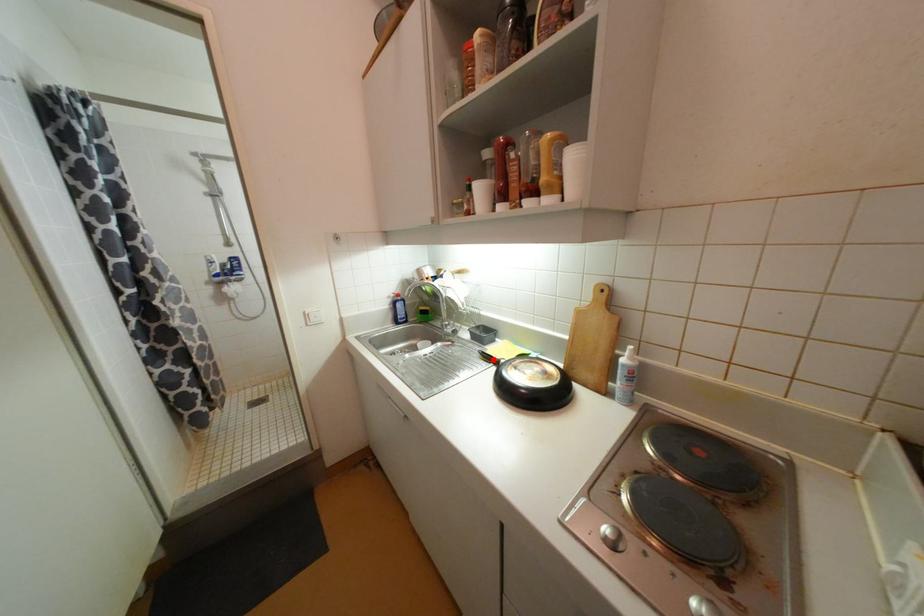
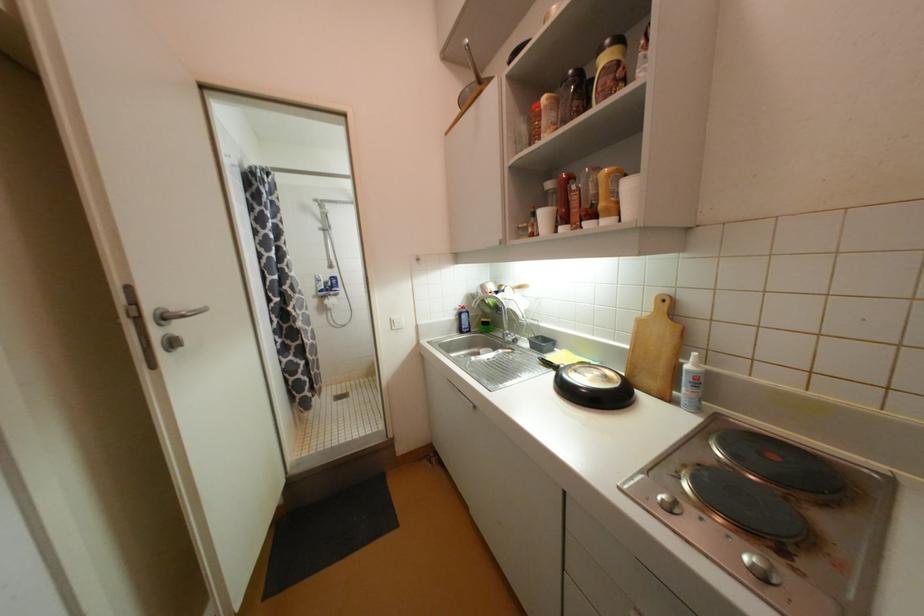
In the second image, find the point that corresponds to the highlighted location in the first image.

(553, 365)